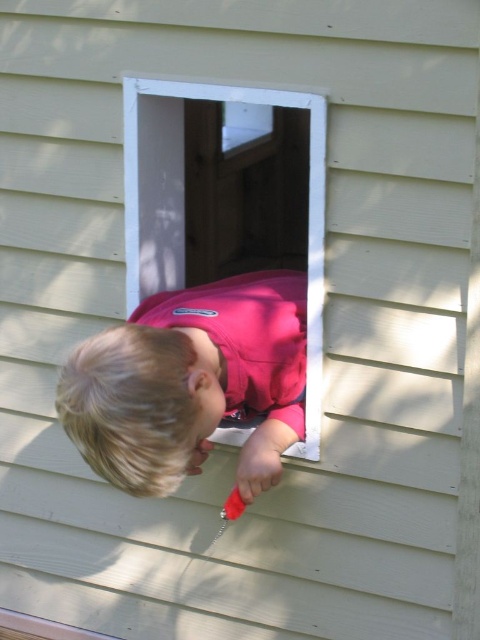
You are a parent trying to ensure your child can fit through a window opening. You see the pink matte shirt at center and the white plastic window at center. Which object has a greater width?

The pink matte shirt at center has a greater width than the white plastic window at center.

You are a photographer trying to capture the child in the scene. You want to ensure the pink matte shirt at center and the white plastic window at center are both visible in your shot. Based on their positions, which object should you focus on first to ensure both are in frame?

The pink matte shirt at center is to the right of the white plastic window at center. To ensure both are in frame, focus on the white plastic window at center first since it is on the left, allowing you to adjust the camera to include the shirt on the right.